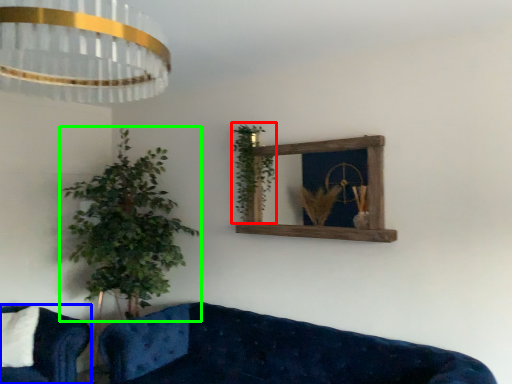
Question: Which object is positioned closest to vegetation (highlighted by a red box)? Select from studio couch (highlighted by a blue box) and houseplant (highlighted by a green box).

Choices:
 (A) studio couch
 (B) houseplant

Answer: (B)